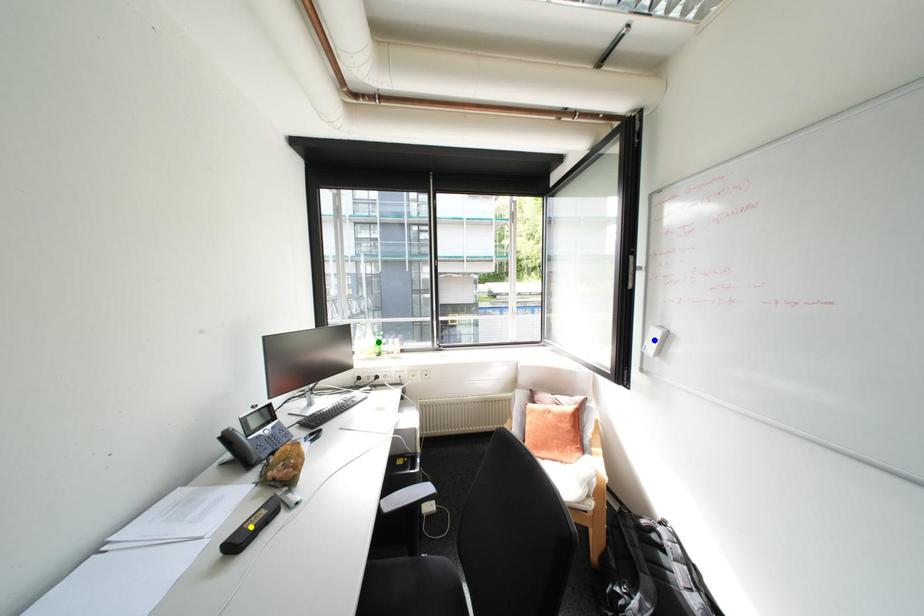
Order these from nearest to farthest:
blue point, green point, yellow point

1. yellow point
2. blue point
3. green point